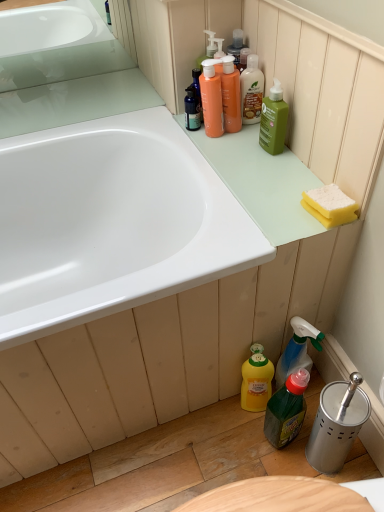
You are a GUI agent. You are given a task and a screenshot of the screen. Output one action in this format:
    pyautogui.click(x=<x>, y=<y>)
    Task: Click on the free space in front of green matte bottle at upper right, which appears as the 3th cleaning product when viewed from the top
    This screenshot has width=384, height=512.
    Given the screenshot: What is the action you would take?
    pyautogui.click(x=272, y=179)